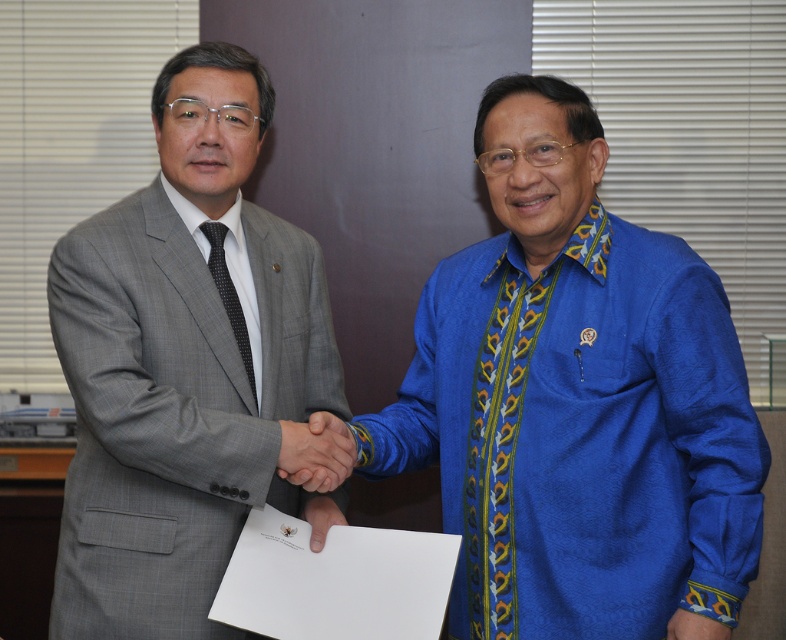
Question: Which point is farther from the camera taking this photo?

Choices:
 (A) (674, 618)
 (B) (682, 458)

Answer: (B)

Question: Which point appears closest to the camera in this image?

Choices:
 (A) (509, 554)
 (B) (195, 460)

Answer: (B)

Question: Does blue patterned fabric at center have a larger size compared to white paper at center?

Choices:
 (A) yes
 (B) no

Answer: (B)

Question: Which is farther from the blue silk shirt at center?

Choices:
 (A) black textured tie at center
 (B) white paper at center
 (C) matte black hands at center

Answer: (A)

Question: Is matte black hands at center positioned before blue patterned fabric at center?

Choices:
 (A) no
 (B) yes

Answer: (A)

Question: Where is gray textured suit at left located in relation to black textured tie at center in the image?

Choices:
 (A) below
 (B) above

Answer: (A)